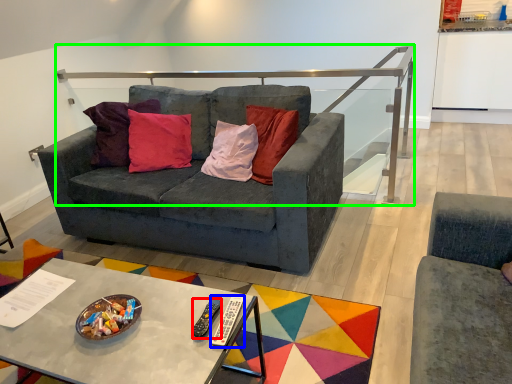
Question: Based on their relative distances, which object is farther from remote (highlighted by a red box)? Choose from remote (highlighted by a blue box) and balustrade (highlighted by a green box).

Choices:
 (A) remote
 (B) balustrade

Answer: (B)